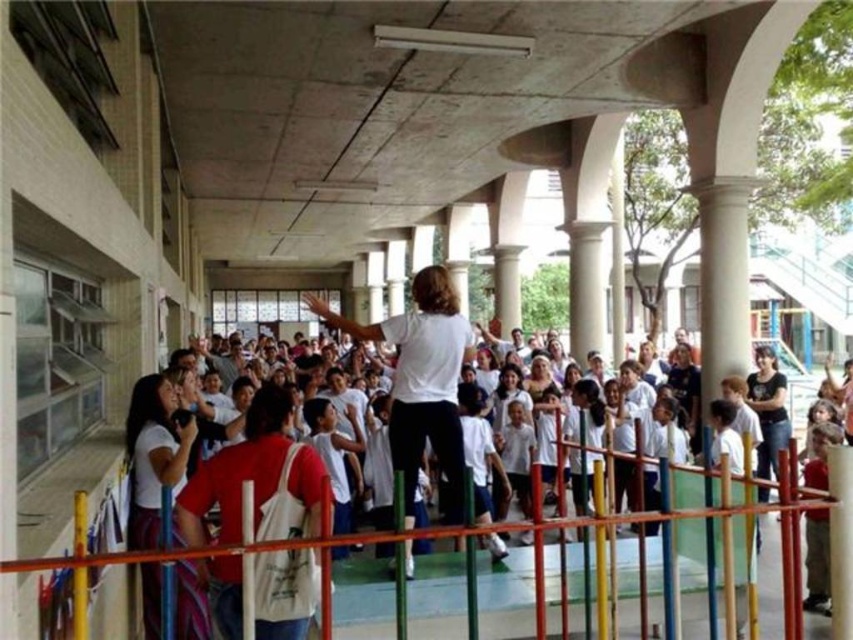
You are standing at the entrance of the covered walkway and see the point marked at coordinates (508, 600). What object is located at this point?

The point at coordinates (508, 600) corresponds to the multicolored plastic fence at center.

You are a painter assigned to paint the light brown wooden pole at right and the white cotton shirt at center. If you have enough paint for only one object, which one should you choose based on their widths?

The light brown wooden pole at right is wider than the white cotton shirt at center, so you should choose to paint the light brown wooden pole at right first since it requires more paint.